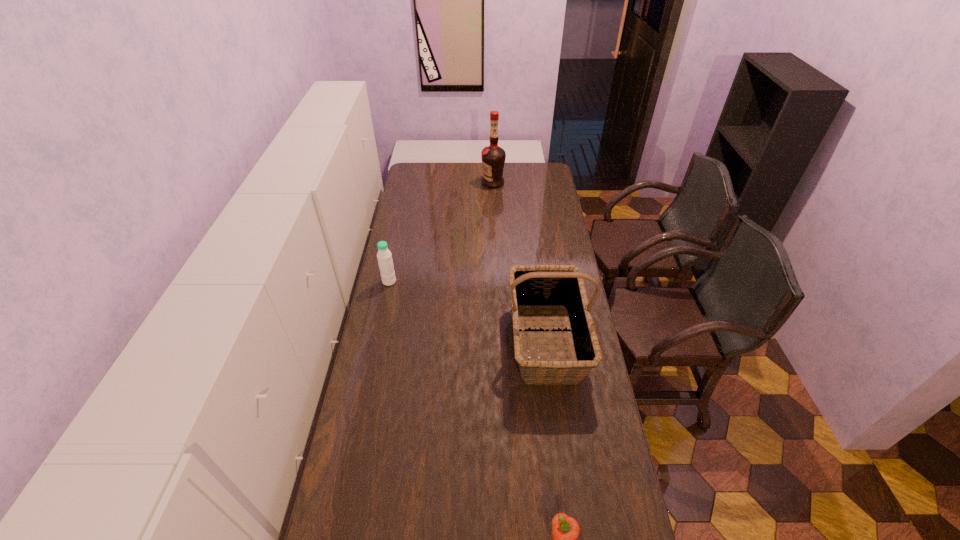
Where is `object located at the far edge`? object located at the far edge is located at coordinates (493, 157).

This screenshot has height=540, width=960. Find the location of `object located at the left edge`. object located at the left edge is located at coordinates (384, 256).

I want to click on object at the right edge, so click(x=554, y=287).

In the image, there is a desktop. At what (x,y) coordinates should I click in order to perform the action: click on vacant area at the far edge. Please return your answer as a coordinate pair (x, y). Image resolution: width=960 pixels, height=540 pixels. Looking at the image, I should click on (506, 170).

Where is `vacant space at the left edge of the desktop`? vacant space at the left edge of the desktop is located at coordinates (390, 455).

The image size is (960, 540). In the image, there is a desktop. What are the coordinates of `vacant space at the right edge` in the screenshot? It's located at (548, 213).

Where is `vacant space at the far left corner of the desktop`? The height and width of the screenshot is (540, 960). vacant space at the far left corner of the desktop is located at coordinates (425, 166).

In the image, there is a desktop. Where is `vacant space at the far right corner`? Image resolution: width=960 pixels, height=540 pixels. vacant space at the far right corner is located at coordinates (527, 165).

The image size is (960, 540). I want to click on empty space between the third tallest object and the basket, so click(x=468, y=312).

The height and width of the screenshot is (540, 960). Identify the location of vacant region between the liquor and the water bottle. (441, 232).